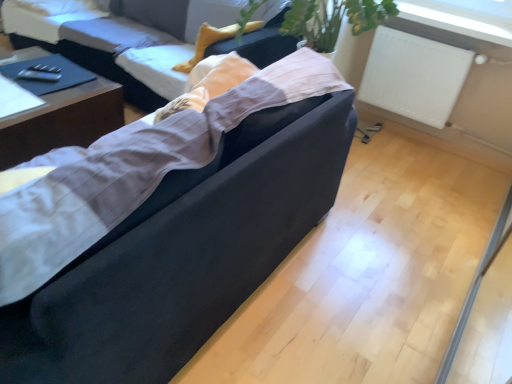
Question: Is velvet black couch at center, marked as the first studio couch in a back-to-front arrangement, to the left or to the right of suede-like black couch at center, the first studio couch positioned from the front, in the image?

Choices:
 (A) left
 (B) right

Answer: (A)

Question: In the image, is velvet black couch at center, positioned as the second studio couch in front-to-back order, positioned in front of or behind suede-like black couch at center, the second studio couch viewed from the back?

Choices:
 (A) front
 (B) behind

Answer: (B)

Question: Based on their relative distances, which object is farther from the white matte radiator at upper right?

Choices:
 (A) velvet black couch at center, marked as the first studio couch in a back-to-front arrangement
 (B) dark wood table at left
 (C) suede-like black couch at center, the second studio couch viewed from the back

Answer: (B)

Question: Considering the real-world distances, which object is farthest from the suede-like black couch at center, the first studio couch positioned from the front?

Choices:
 (A) dark wood table at left
 (B) white matte radiator at upper right
 (C) velvet black couch at center, marked as the first studio couch in a back-to-front arrangement

Answer: (B)